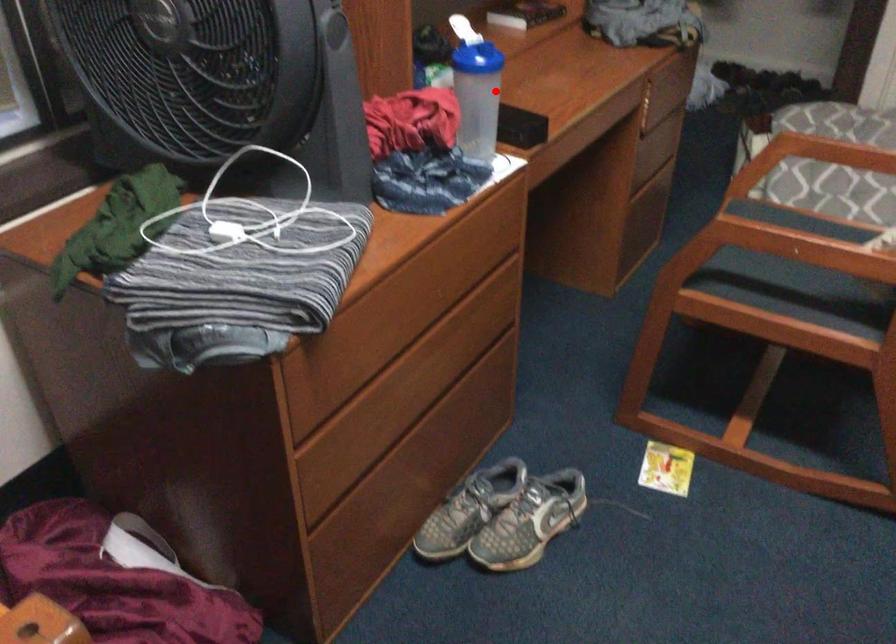
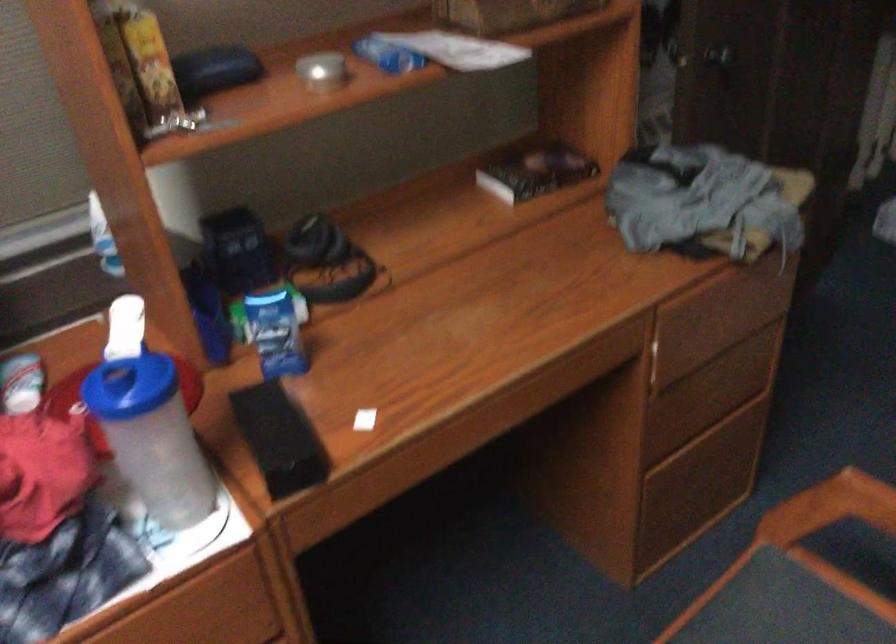
Question: I am providing you with two images of the same scene from different viewpoints. A red point is marked on the first image. Is the red point's position out of view in image 2?

Choices:
 (A) Yes
 (B) No

Answer: (B)